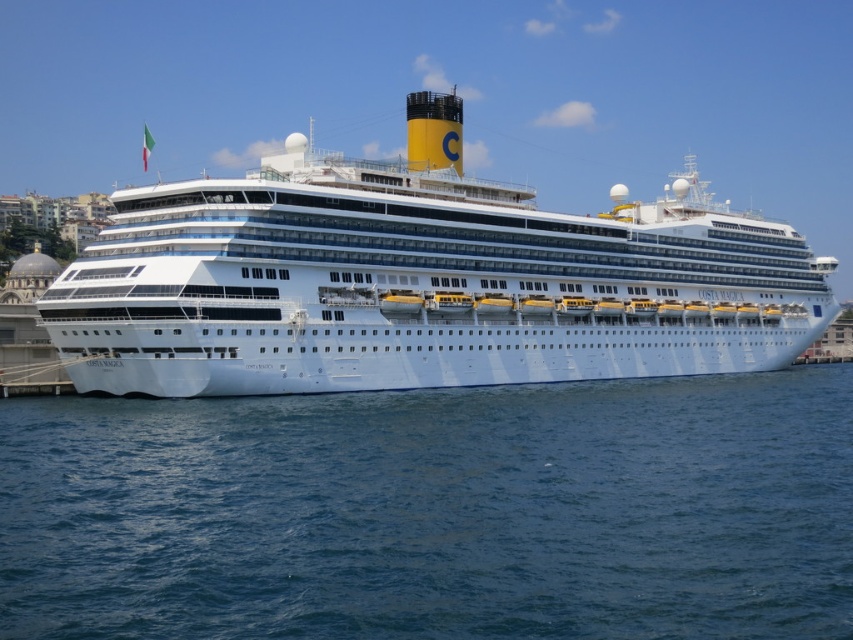
Question: Which point is farther to the camera?

Choices:
 (A) white glossy cruise ship at center
 (B) blue water at lower center

Answer: (A)

Question: Which of the following is the closest to the observer?

Choices:
 (A) tap(22, 436)
 (B) tap(372, 323)

Answer: (A)

Question: Is blue water at lower center in front of white glossy cruise ship at center?

Choices:
 (A) no
 (B) yes

Answer: (B)

Question: Which point appears farthest from the camera in this image?

Choices:
 (A) (178, 416)
 (B) (605, 342)

Answer: (B)

Question: Is blue water at lower center positioned before white glossy cruise ship at center?

Choices:
 (A) no
 (B) yes

Answer: (B)

Question: Can you confirm if blue water at lower center is bigger than white glossy cruise ship at center?

Choices:
 (A) no
 (B) yes

Answer: (A)